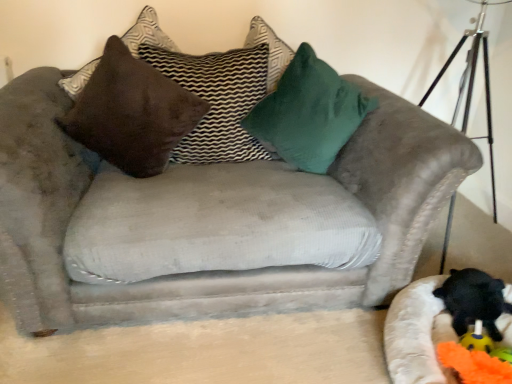
Question: From the image's perspective, is beige fabric cat bed at lower right positioned above or below orange fabric toy at lower right?

Choices:
 (A) below
 (B) above

Answer: (B)

Question: Is beige fabric cat bed at lower right taller or shorter than orange fabric toy at lower right?

Choices:
 (A) tall
 (B) short

Answer: (A)

Question: Which object is positioned farthest from the green velvet pillow at upper center, the 1th pillow positioned from the right?

Choices:
 (A) brown suede pillow at upper center, the second pillow in the left-to-right sequence
 (B) beige fabric cat bed at lower right
 (C) black plush toy at lower right
 (D) orange fabric toy at lower right
 (E) brown suede pillow at upper left, the first pillow viewed from the left

Answer: (D)

Question: Estimate the real-world distances between objects in this image. Which object is farther from the green velvet pillow at upper center, the 1th pillow positioned from the right?

Choices:
 (A) brown suede pillow at upper left, the third pillow from the right
 (B) black plush toy at lower right
 (C) beige fabric cat bed at lower right
 (D) orange fabric toy at lower right
 (E) brown suede pillow at upper center, which is the second pillow from right to left

Answer: (D)